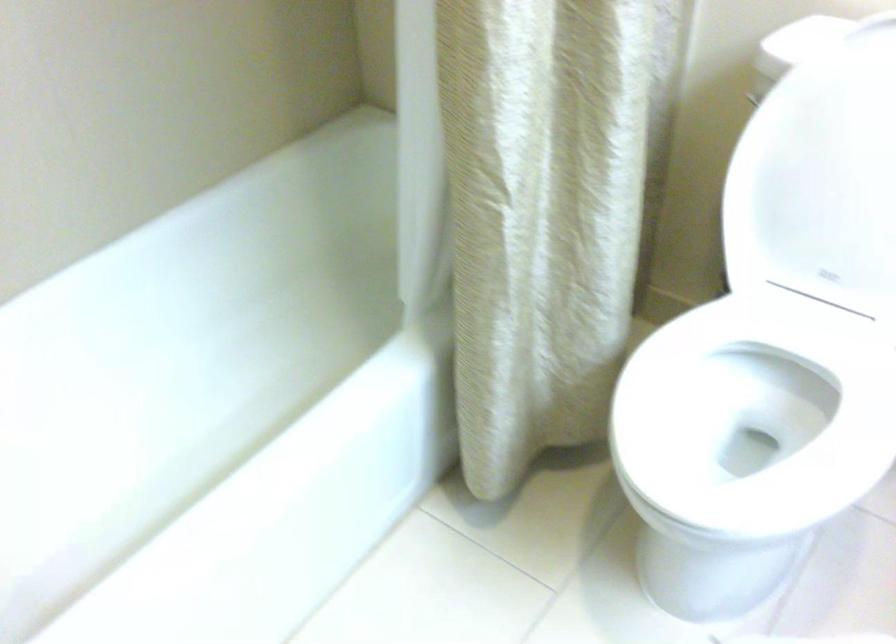
Where is `white toilet lid`? white toilet lid is located at coordinates (821, 178).